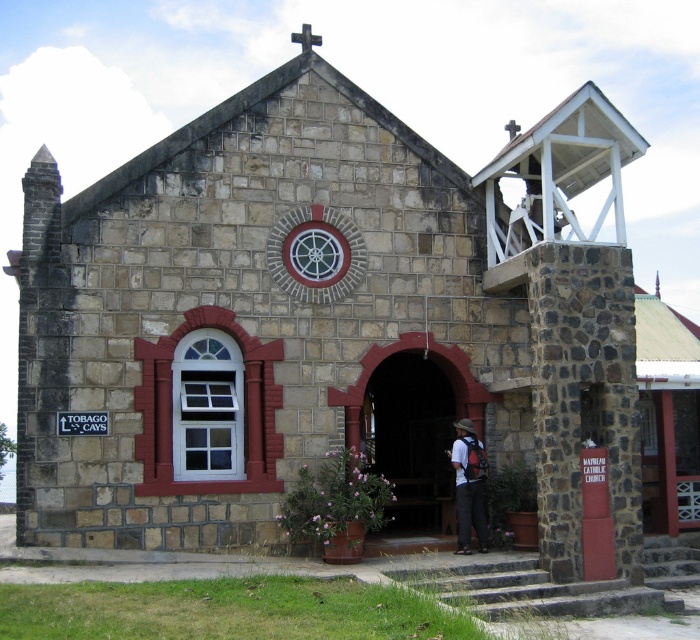
Question: Observing the image, what is the correct spatial positioning of matte black backpack at lower center in reference to black stone cross at upper center?

Choices:
 (A) above
 (B) below

Answer: (B)

Question: Where is matte black backpack at lower center located in relation to black stone cross at upper center in the image?

Choices:
 (A) above
 (B) below

Answer: (B)

Question: Which object appears farthest from the camera in this image?

Choices:
 (A) matte black backpack at lower center
 (B) black stone cross at upper center

Answer: (B)

Question: Which of the following is the farthest from the observer?

Choices:
 (A) (470, 518)
 (B) (302, 44)

Answer: (B)

Question: Does matte black backpack at lower center have a larger size compared to black stone cross at upper center?

Choices:
 (A) no
 (B) yes

Answer: (A)